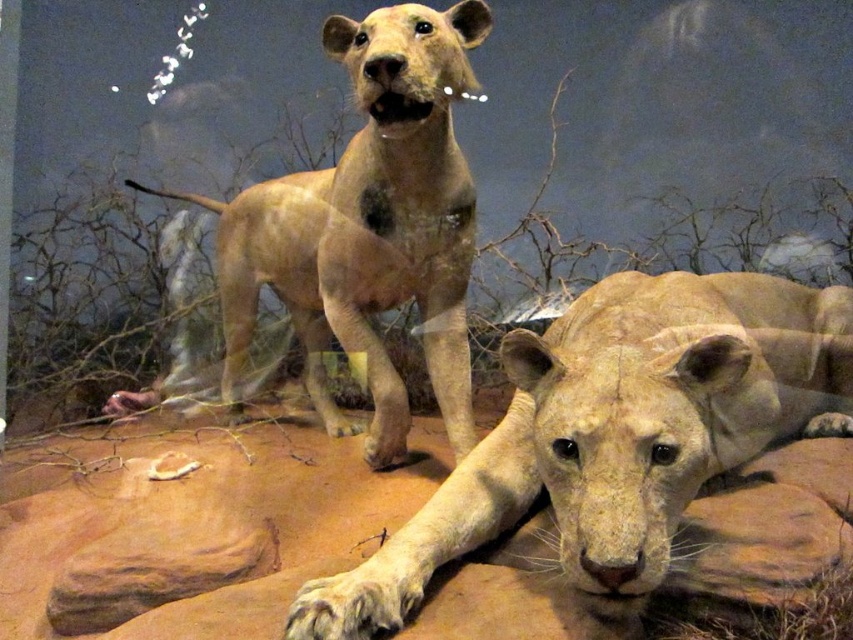
Question: Which point is farther to the camera?

Choices:
 (A) click(372, 268)
 (B) click(821, 392)

Answer: (B)

Question: Is light beige fur at center positioned at the back of light brown fur lion at center?

Choices:
 (A) no
 (B) yes

Answer: (A)

Question: Which point is closer to the camera taking this photo?

Choices:
 (A) (463, 324)
 (B) (463, 548)

Answer: (B)

Question: Can you confirm if light beige fur at center is bigger than light brown fur lion at center?

Choices:
 (A) no
 (B) yes

Answer: (A)

Question: Is light beige fur at center to the right of light brown fur lion at center from the viewer's perspective?

Choices:
 (A) no
 (B) yes

Answer: (B)